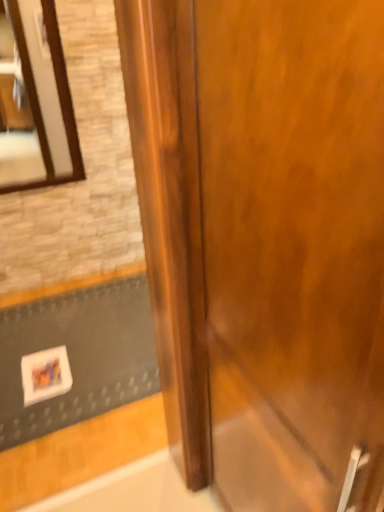
Question: Is wooden-framed mirror at upper left closer to camera compared to white matte doormat at lower left?

Choices:
 (A) yes
 (B) no

Answer: (B)

Question: Is wooden-framed mirror at upper left facing away from white matte doormat at lower left?

Choices:
 (A) yes
 (B) no

Answer: (B)

Question: Considering the relative positions of wooden-framed mirror at upper left and white matte doormat at lower left in the image provided, is wooden-framed mirror at upper left to the right of white matte doormat at lower left from the viewer's perspective?

Choices:
 (A) no
 (B) yes

Answer: (A)

Question: Considering the relative sizes of wooden-framed mirror at upper left and white matte doormat at lower left in the image provided, is wooden-framed mirror at upper left wider than white matte doormat at lower left?

Choices:
 (A) yes
 (B) no

Answer: (B)

Question: Is there a large distance between wooden-framed mirror at upper left and white matte doormat at lower left?

Choices:
 (A) no
 (B) yes

Answer: (A)

Question: In terms of size, does glossy wood door at center appear bigger or smaller than wooden-framed mirror at upper left?

Choices:
 (A) small
 (B) big

Answer: (B)

Question: Is point (276, 70) closer or farther from the camera than point (64, 170)?

Choices:
 (A) farther
 (B) closer

Answer: (B)

Question: In the image, is glossy wood door at center positioned in front of or behind wooden-framed mirror at upper left?

Choices:
 (A) front
 (B) behind

Answer: (A)

Question: Is glossy wood door at center inside or outside of wooden-framed mirror at upper left?

Choices:
 (A) inside
 (B) outside

Answer: (B)

Question: Is point (x=13, y=376) positioned closer to the camera than point (x=39, y=53)?

Choices:
 (A) farther
 (B) closer

Answer: (B)

Question: Considering the positions of white matte doormat at lower left and wooden-framed mirror at upper left in the image, is white matte doormat at lower left taller or shorter than wooden-framed mirror at upper left?

Choices:
 (A) tall
 (B) short

Answer: (B)

Question: Considering the positions of white matte doormat at lower left and wooden-framed mirror at upper left in the image, is white matte doormat at lower left wider or thinner than wooden-framed mirror at upper left?

Choices:
 (A) wide
 (B) thin

Answer: (A)

Question: From a real-world perspective, relative to wooden-framed mirror at upper left, is white matte doormat at lower left vertically above or below?

Choices:
 (A) above
 (B) below

Answer: (B)

Question: From a real-world perspective, relative to glossy wood door at center, is wooden-framed mirror at upper left vertically above or below?

Choices:
 (A) above
 (B) below

Answer: (A)

Question: In the image, is wooden-framed mirror at upper left positioned in front of or behind glossy wood door at center?

Choices:
 (A) front
 (B) behind

Answer: (B)